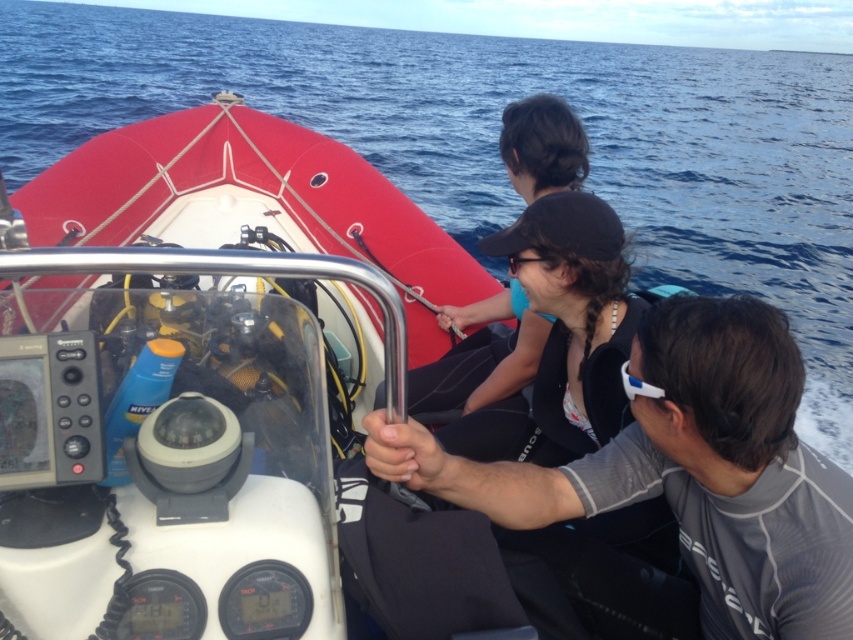
You are a diver preparing to board the boat and notice the gray matte wetsuit at center and the black matte wetsuit at center. Which wetsuit is taller?

The gray matte wetsuit at center is taller than the black matte wetsuit at center.

You are a sailor who needs to navigate the boat to a safe harbor. You see the white matte boat at center and the blue water at center. Which object is located below the other?

The white matte boat at center is positioned under the blue water at center, so the boat is below the water.